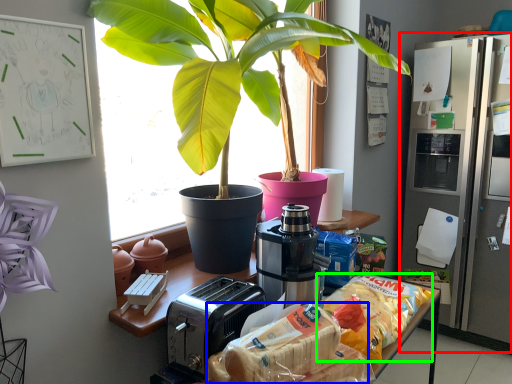
Question: Which object is positioned closest to fridge (highlighted by a red box)? Select from snack (highlighted by a blue box) and snack (highlighted by a green box).

Choices:
 (A) snack
 (B) snack

Answer: (B)